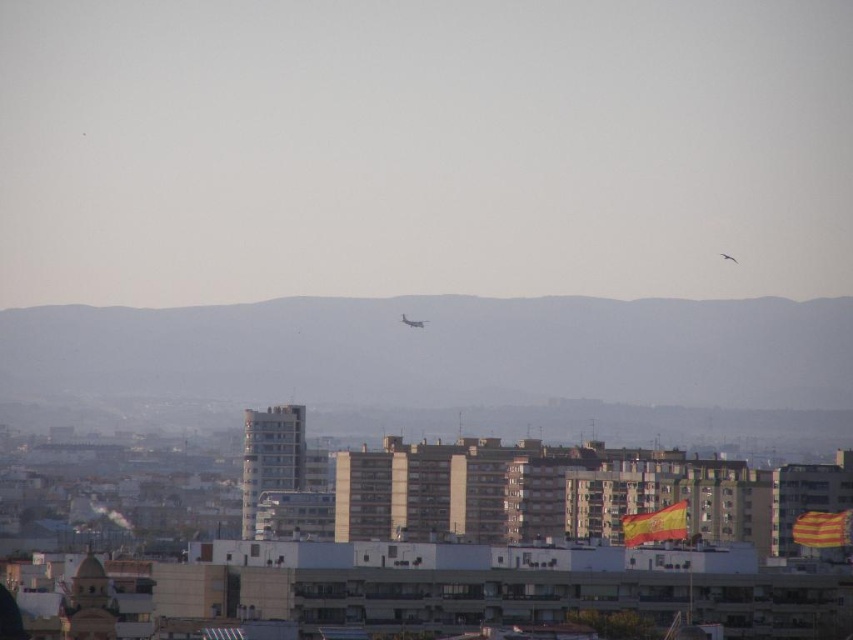
You are standing in the urban landscape and want to determine which of the two points, point (418, 324) or point (721, 257), is nearer to you. Based on the scene description, which point is closer?

Point (418, 324) is closer to the viewer than point (721, 257).